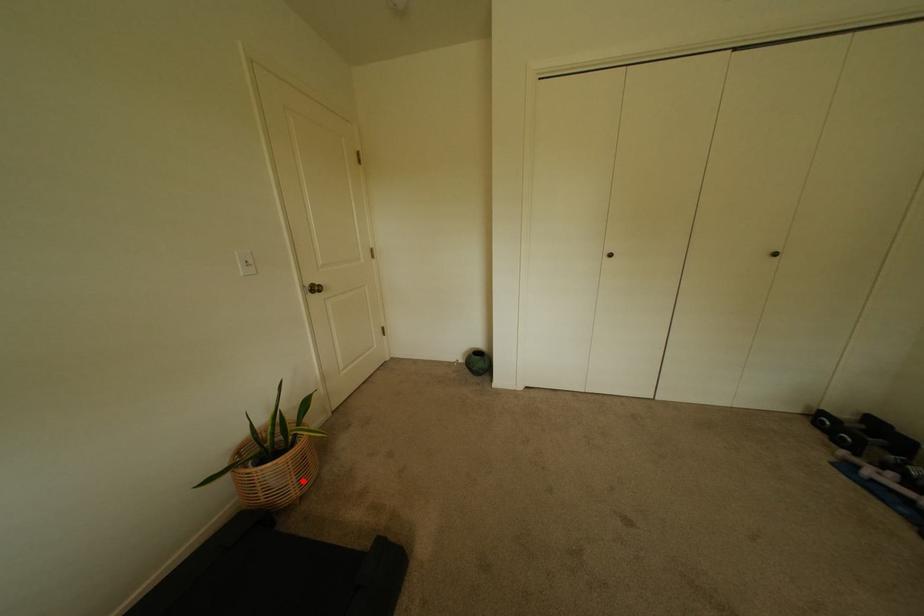
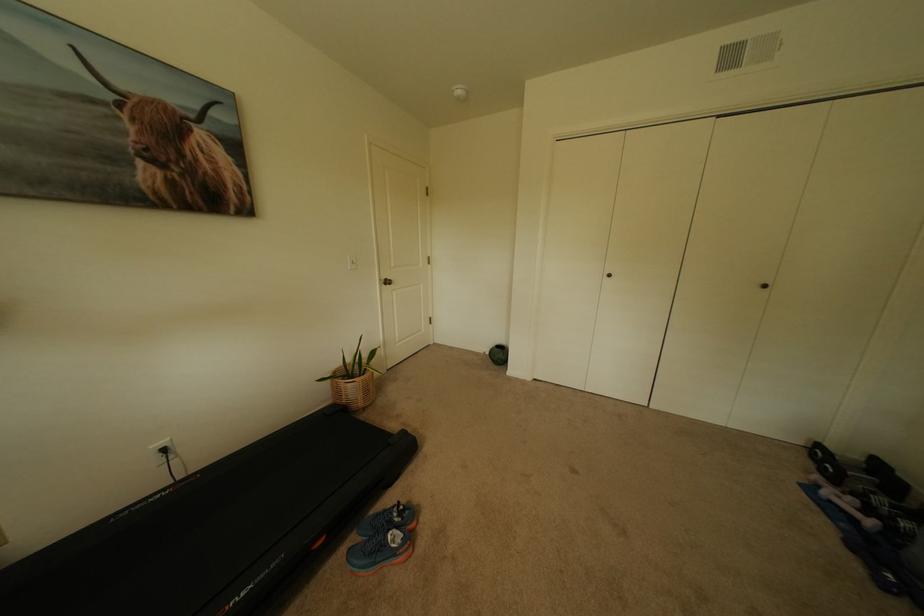
Question: I am providing you with two images of the same scene from different viewpoints. In image1, a red point is highlighted. Considering the same 3D point in image2, which of the following is correct?

Choices:
 (A) It is closer
 (B) It is farther

Answer: (A)